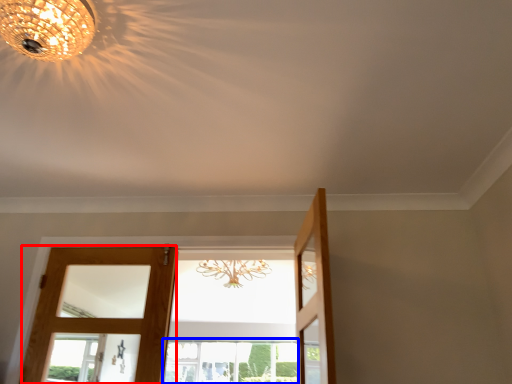
Question: Among these objects, which one is farthest to the camera, door (highlighted by a red box) or window (highlighted by a blue box)?

Choices:
 (A) door
 (B) window

Answer: (B)